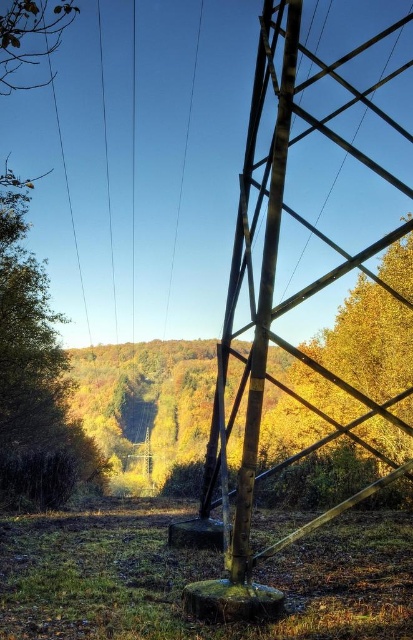
Question: Is green mossy stump at center above yellow-green foliage at center-right?

Choices:
 (A) yes
 (B) no

Answer: (B)

Question: Among these points, which one is farthest from the camera?

Choices:
 (A) (185, 164)
 (B) (379, 596)
 (C) (337, 387)
 (D) (61, 412)

Answer: (A)

Question: Is green leafy tree at left to the left of smooth wire at upper center from the viewer's perspective?

Choices:
 (A) no
 (B) yes

Answer: (B)

Question: Which point is farther to the camera?

Choices:
 (A) (199, 29)
 (B) (142, 554)
 (C) (280, 346)

Answer: (A)

Question: From the image, what is the correct spatial relationship of yellow-green foliage at center-right in relation to smooth wire at upper center?

Choices:
 (A) left
 (B) right

Answer: (B)

Question: Which point appears farthest from the camera in this image?

Choices:
 (A) (180, 195)
 (B) (327, 378)

Answer: (A)